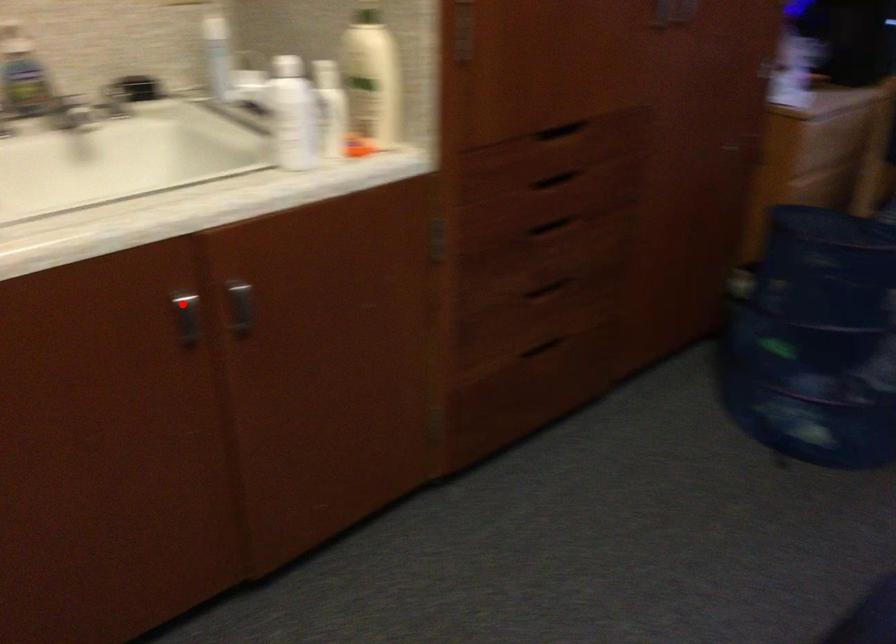
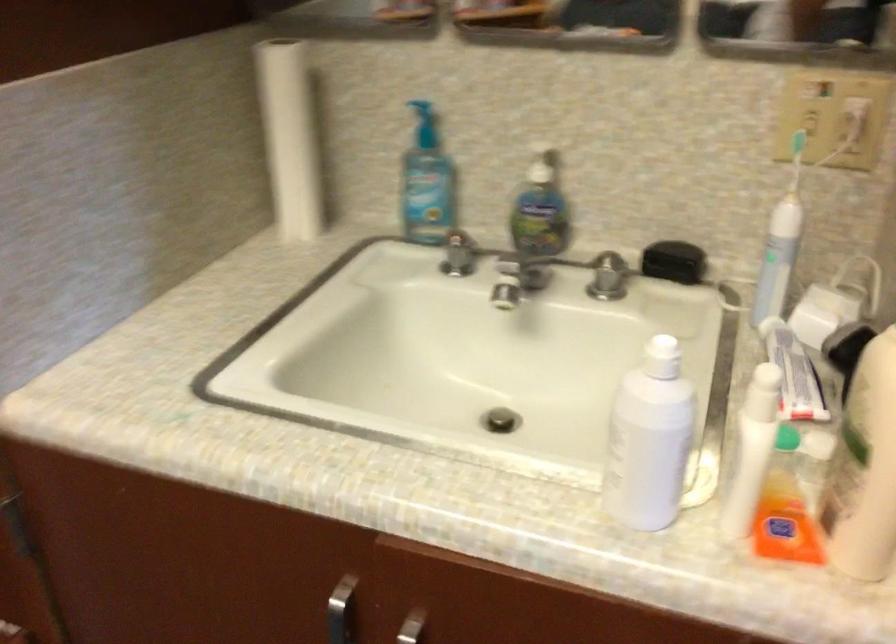
Where in the second image is the point corresponding to the highlighted location from the first image?

(340, 611)